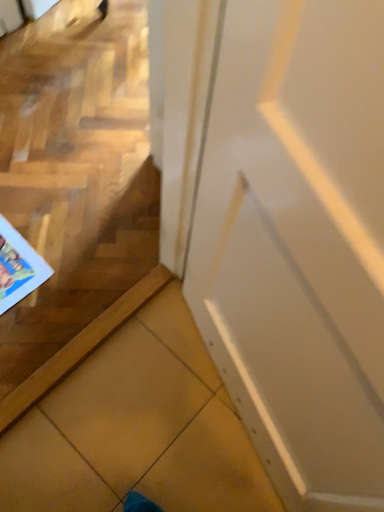
This screenshot has height=512, width=384. In order to click on free location in front of white glossy door at center in this screenshot , I will do `click(190, 465)`.